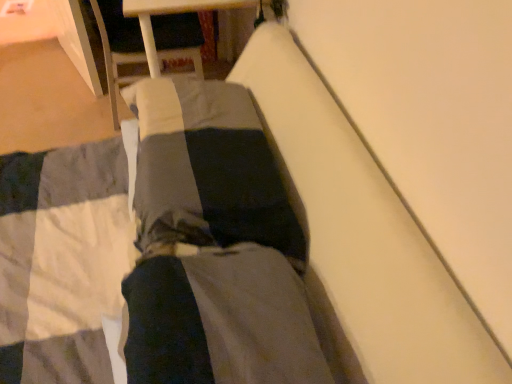
Locate an element on the screen. The height and width of the screenshot is (384, 512). dark gray fabric at center is located at coordinates (214, 246).

Describe the element at coordinates (214, 246) in the screenshot. This screenshot has height=384, width=512. I see `dark gray fabric at center` at that location.

What do you see at coordinates (221, 321) in the screenshot? The height and width of the screenshot is (384, 512). I see `dark gray cotton pants at center` at bounding box center [221, 321].

Locate an element on the screen. This screenshot has width=512, height=384. dark gray cotton pants at center is located at coordinates (221, 321).

Image resolution: width=512 pixels, height=384 pixels. Identify the location of dark gray fabric at center. (214, 246).

Is dark gray fabric at center to the right of dark gray cotton pants at center from the viewer's perspective?

No, dark gray fabric at center is not to the right of dark gray cotton pants at center.

Is the depth of dark gray fabric at center less than that of dark gray cotton pants at center?

No, dark gray fabric at center is further to the viewer.

Is point (159, 90) farther from viewer compared to point (207, 351)?

Yes, it is behind point (207, 351).

From the image's perspective, between dark gray fabric at center and dark gray cotton pants at center, who is located below?

Answer: dark gray cotton pants at center appears lower in the image.

From a real-world perspective, between dark gray fabric at center and dark gray cotton pants at center, who is vertically lower?

dark gray fabric at center.

Does dark gray fabric at center have a greater width compared to dark gray cotton pants at center?

No.

Considering the sizes of objects dark gray fabric at center and dark gray cotton pants at center in the image provided, who is taller, dark gray fabric at center or dark gray cotton pants at center?

Standing taller between the two is dark gray cotton pants at center.

Who is smaller, dark gray fabric at center or dark gray cotton pants at center?

Smaller between the two is dark gray cotton pants at center.

Choose the correct answer: Is dark gray fabric at center inside dark gray cotton pants at center or outside it?

dark gray fabric at center is outside dark gray cotton pants at center.

Is dark gray fabric at center not close to dark gray cotton pants at center?

Actually, dark gray fabric at center and dark gray cotton pants at center are a little close together.

Is dark gray fabric at center turned away from dark gray cotton pants at center?

dark gray fabric at center is not turned away from dark gray cotton pants at center.

You are a GUI agent. You are given a task and a screenshot of the screen. Output one action in this format:
    pyautogui.click(x=<x>, y=<y>)
    Task: Click on the couple behind the dark gray cotton pants at center
    This screenshot has width=512, height=384.
    Given the screenshot: What is the action you would take?
    [214, 246]

Is dark gray cotton pants at center to the right of dark gray fabric at center from the viewer's perspective?

Indeed, dark gray cotton pants at center is positioned on the right side of dark gray fabric at center.

Is dark gray cotton pants at center further to the viewer compared to dark gray fabric at center?

No.

Is point (217, 342) behind point (266, 154)?

No, it is not.

Consider the image. From the image's perspective, which object appears higher, dark gray cotton pants at center or dark gray fabric at center?

dark gray fabric at center appears higher in the image.

From a real-world perspective, between dark gray cotton pants at center and dark gray fabric at center, who is vertically higher?

From a 3D spatial view, dark gray cotton pants at center is above.

Is dark gray cotton pants at center wider or thinner than dark gray fabric at center?

dark gray cotton pants at center is wider than dark gray fabric at center.

Which of these two, dark gray cotton pants at center or dark gray fabric at center, stands shorter?

With less height is dark gray fabric at center.

Can you confirm if dark gray cotton pants at center is bigger than dark gray fabric at center?

Actually, dark gray cotton pants at center might be smaller than dark gray fabric at center.

Is dark gray cotton pants at center outside of dark gray fabric at center?

That's correct, dark gray cotton pants at center is outside of dark gray fabric at center.

Is dark gray cotton pants at center not near dark gray fabric at center?

They are positioned close to each other.

Is dark gray cotton pants at center positioned with its back to dark gray fabric at center?

No, dark gray cotton pants at center is not facing the opposite direction of dark gray fabric at center.

Can you tell me how much dark gray cotton pants at center and dark gray fabric at center differ in facing direction?

2.27 degrees.

Find the location of `couple on the left of dark gray cotton pants at center`. couple on the left of dark gray cotton pants at center is located at coordinates pyautogui.click(x=214, y=246).

Image resolution: width=512 pixels, height=384 pixels. In order to click on couple on the left side of dark gray cotton pants at center in this screenshot , I will do `click(214, 246)`.

The width and height of the screenshot is (512, 384). Find the location of `pants above the dark gray fabric at center (from a real-world perspective)`. pants above the dark gray fabric at center (from a real-world perspective) is located at coordinates (221, 321).